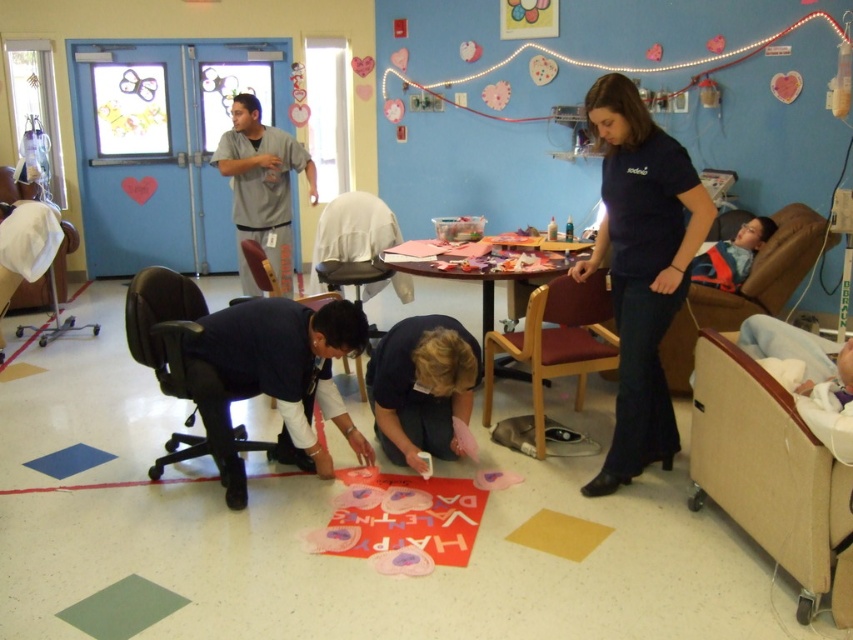
Does dark blue shirt at center appear over black leather office chair at lower left?

Correct, dark blue shirt at center is located above black leather office chair at lower left.

Where is `dark blue shirt at center`? This screenshot has height=640, width=853. dark blue shirt at center is located at coordinates (641, 268).

You are a GUI agent. You are given a task and a screenshot of the screen. Output one action in this format:
    pyautogui.click(x=<x>, y=<y>)
    Task: Click on the dark blue shirt at center
    Image resolution: width=853 pixels, height=640 pixels.
    Given the screenshot: What is the action you would take?
    pyautogui.click(x=641, y=268)

Locate an element on the screen. Image resolution: width=853 pixels, height=640 pixels. beige fabric hospital bed at lower right is located at coordinates (770, 474).

Is beige fabric hospital bed at lower right closer to camera compared to black leather office chair at lower left?

That is True.

The height and width of the screenshot is (640, 853). I want to click on beige fabric hospital bed at lower right, so click(770, 474).

Where is `beige fabric hospital bed at lower right`? beige fabric hospital bed at lower right is located at coordinates (770, 474).

Is brown leather armchair at right to the right of white fabric chair at left from the viewer's perspective?

Correct, you'll find brown leather armchair at right to the right of white fabric chair at left.

Is point (811, 248) less distant than point (0, 234)?

That is True.

Does point (793, 241) come farther from viewer compared to point (49, 260)?

No, (793, 241) is in front of (49, 260).

Where is `brown leather armchair at right`? brown leather armchair at right is located at coordinates (746, 289).